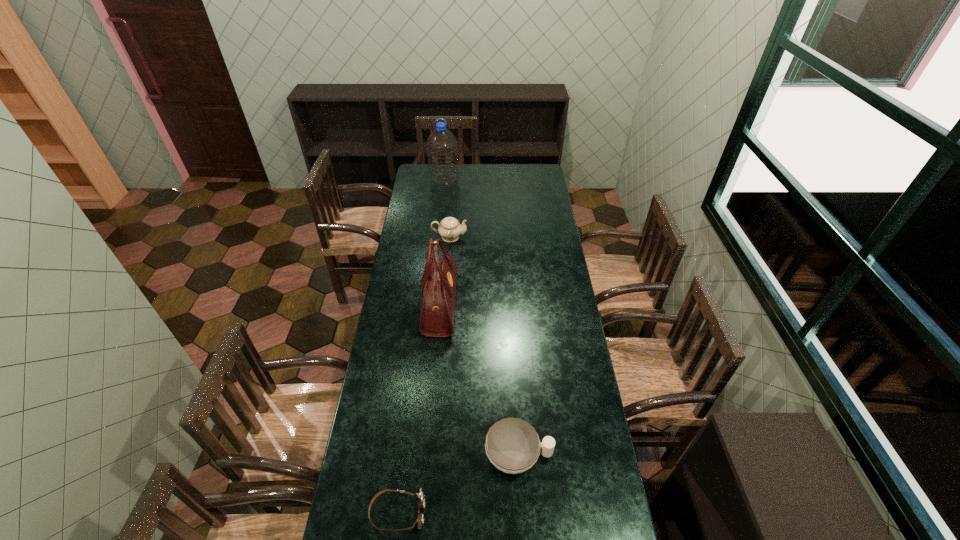
Where is `water jug`? The width and height of the screenshot is (960, 540). water jug is located at coordinates 442,146.

You are a GUI agent. You are given a task and a screenshot of the screen. Output one action in this format:
    pyautogui.click(x=<x>, y=<y>)
    Task: Click on the handbag
    The height and width of the screenshot is (540, 960).
    Given the screenshot: What is the action you would take?
    pyautogui.click(x=438, y=282)

Image resolution: width=960 pixels, height=540 pixels. I want to click on the third tallest object, so click(x=450, y=229).

Identify the location of the farther chinaware. This screenshot has width=960, height=540. (450, 229).

The height and width of the screenshot is (540, 960). What are the coordinates of `the fourth tallest object` in the screenshot? It's located at (512, 445).

Locate an element on the screen. This screenshot has height=540, width=960. the shorter chinaware is located at coordinates (512, 445).

The height and width of the screenshot is (540, 960). Find the location of `the shortest object`. the shortest object is located at coordinates (420, 497).

The width and height of the screenshot is (960, 540). In order to click on the nearest object in this screenshot , I will do `click(420, 497)`.

I want to click on vacant space situated on the front of the farthest object, so click(442, 209).

The height and width of the screenshot is (540, 960). Identify the location of vacant space located 0.380m on the front-facing side of the third nearest object. (540, 305).